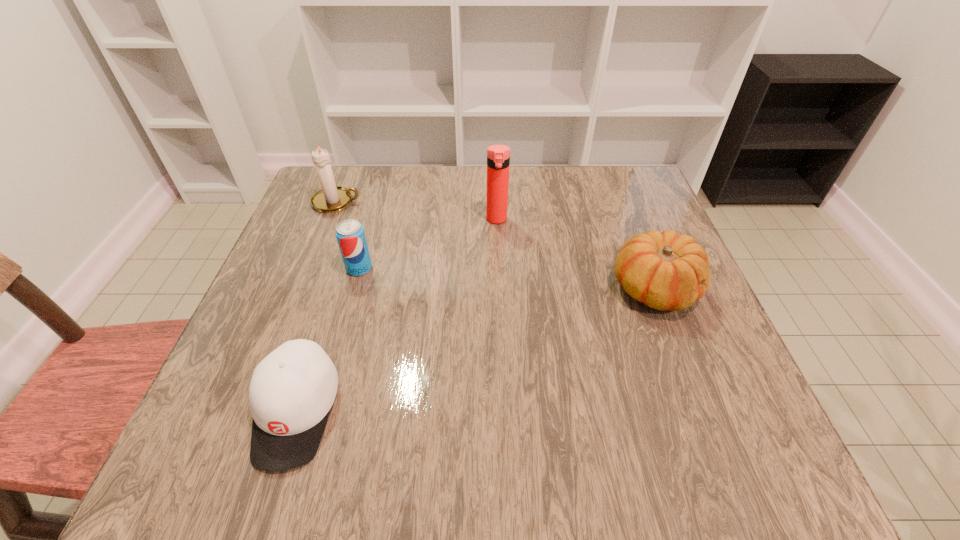
The image size is (960, 540). What are the coordinates of `thermos bottle located at the far edge` in the screenshot? It's located at (498, 156).

Locate an element on the screen. The image size is (960, 540). candle holder situated at the far edge is located at coordinates (331, 198).

Find the location of a particular element. object situated at the near edge is located at coordinates (292, 390).

The height and width of the screenshot is (540, 960). I want to click on candle holder located in the left edge section of the desktop, so click(331, 198).

I want to click on soda can at the left edge, so click(x=350, y=235).

Image resolution: width=960 pixels, height=540 pixels. What are the coordinates of `baseball cap at the left edge` in the screenshot? It's located at pyautogui.click(x=292, y=390).

Locate an element on the screen. The height and width of the screenshot is (540, 960). object present at the right edge is located at coordinates (666, 271).

The width and height of the screenshot is (960, 540). In order to click on object that is at the far left corner in this screenshot , I will do `click(331, 198)`.

Image resolution: width=960 pixels, height=540 pixels. I want to click on object located in the near left corner section of the desktop, so click(x=292, y=390).

The image size is (960, 540). What are the coordinates of `free region at the far edge of the desktop` in the screenshot? It's located at (420, 207).